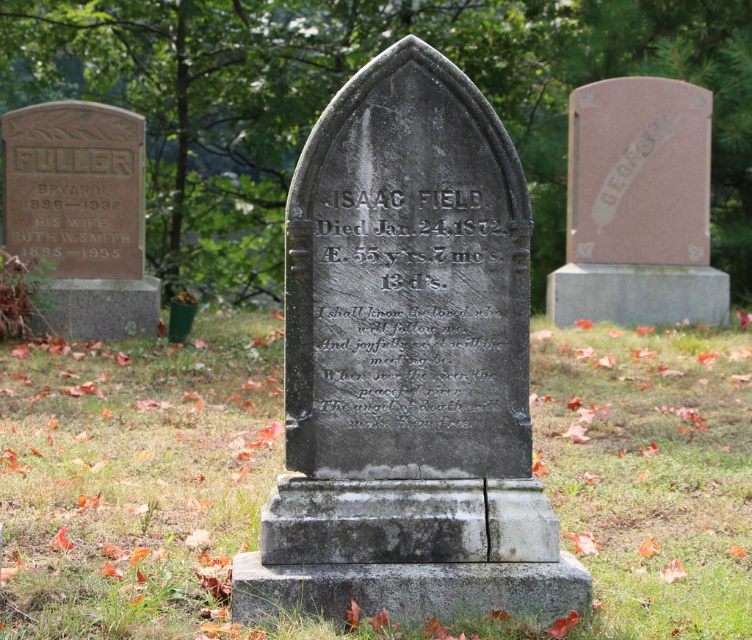
Question: Which point is farther from the camera taking this photo?

Choices:
 (A) (526, 0)
 (B) (522, 476)

Answer: (A)

Question: Does green grass at center have a greater width compared to gray stone gravestone at center?

Choices:
 (A) yes
 (B) no

Answer: (B)

Question: Estimate the real-world distances between objects in this image. Which object is closer to the green leafy tree at center?

Choices:
 (A) green grass at center
 (B) gray stone gravestone at center

Answer: (A)

Question: Which object is positioned closest to the gray stone gravestone at center?

Choices:
 (A) green leafy tree at center
 (B) green grass at center

Answer: (B)

Question: In this image, where is green grass at center located relative to green leafy tree at center?

Choices:
 (A) below
 (B) above

Answer: (A)

Question: Is green grass at center smaller than green leafy tree at center?

Choices:
 (A) yes
 (B) no

Answer: (A)